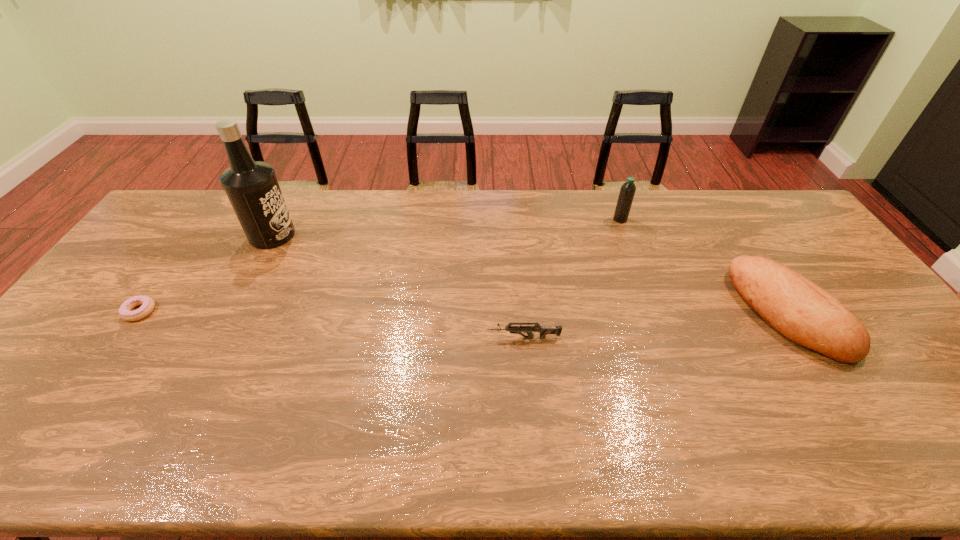
Identify the location of the second object from left to right. The height and width of the screenshot is (540, 960). (x=252, y=188).

I want to click on liquor, so click(x=252, y=188).

This screenshot has height=540, width=960. Find the location of `water bottle`. water bottle is located at coordinates tap(627, 191).

Identify the location of the fourth shortest object. (627, 191).

You are a GUI agent. You are given a task and a screenshot of the screen. Output one action in this format:
    pyautogui.click(x=<x>, y=<y>)
    Task: Click on the rightmost object
    Image resolution: width=960 pixels, height=540 pixels.
    Given the screenshot: What is the action you would take?
    pyautogui.click(x=797, y=308)

I want to click on the third shortest object, so click(x=797, y=308).

Image resolution: width=960 pixels, height=540 pixels. I want to click on the second shortest object, so 543,330.

Locate an element on the screen. The width and height of the screenshot is (960, 540). the third object from right to left is located at coordinates (543, 330).

Find the location of a particular element. The height and width of the screenshot is (540, 960). doughnut is located at coordinates (148, 304).

Find the location of a particular element. This screenshot has height=540, width=960. the leftmost object is located at coordinates (148, 304).